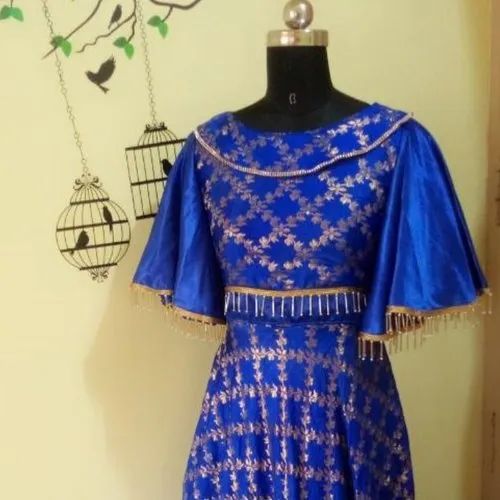
The width and height of the screenshot is (500, 500). I want to click on wall, so click(63, 399).